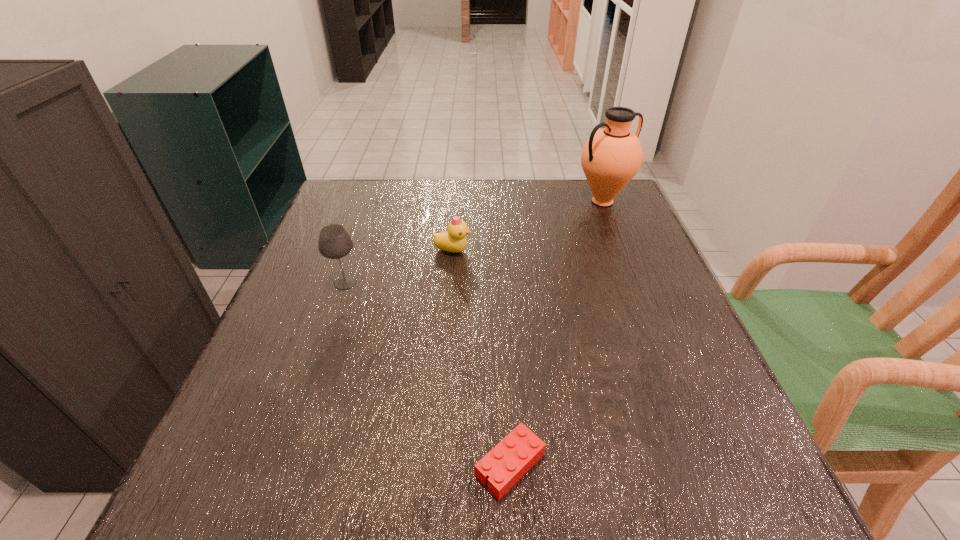
Where is `blank region between the rightmost object and the leftmost object`? This screenshot has height=540, width=960. blank region between the rightmost object and the leftmost object is located at coordinates (474, 242).

Locate an element on the screen. The width and height of the screenshot is (960, 540). free spot between the leftmost object and the second object from right to left is located at coordinates (427, 374).

Where is `object that is the third closest to the rightmost object`? The height and width of the screenshot is (540, 960). object that is the third closest to the rightmost object is located at coordinates (515, 455).

I want to click on object that can be found as the second closest to the second nearest object, so click(x=515, y=455).

This screenshot has width=960, height=540. What are the coordinates of `free location that satisfies the following two spatial constraints: 1. on the back side of the second object from right to left; 2. on the right side of the tallest object` in the screenshot? It's located at (496, 201).

Locate an element on the screen. The width and height of the screenshot is (960, 540). blank area in the image that satisfies the following two spatial constraints: 1. on the front side of the farthest object; 2. on the front-facing side of the duckling is located at coordinates (622, 251).

Locate an element on the screen. vacant area that satisfies the following two spatial constraints: 1. on the front-facing side of the second shortest object; 2. on the right side of the shortest object is located at coordinates (436, 465).